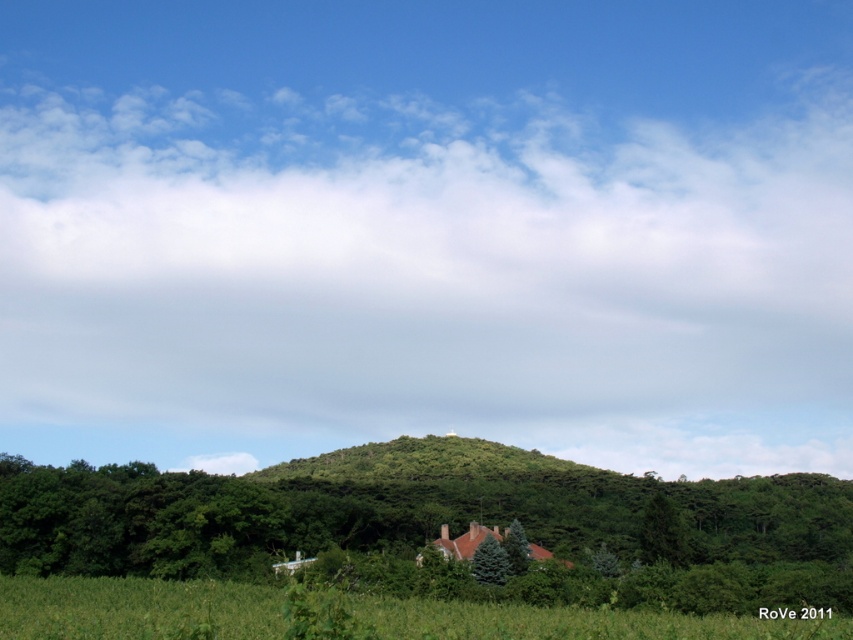
Question: Considering the real-world distances, which object is farthest from the green grassy field at lower center?

Choices:
 (A) green matte tree at lower center
 (B) white fluffy cloud at upper center

Answer: (B)

Question: Which point appears closest to the camera in this image?

Choices:
 (A) (512, 532)
 (B) (492, 556)
 (C) (22, 550)

Answer: (B)

Question: From the image, what is the correct spatial relationship of green leafy tree at center in relation to green matte tree at lower center?

Choices:
 (A) right
 (B) left

Answer: (A)

Question: Among these points, which one is nearest to the camera?

Choices:
 (A) (495, 563)
 (B) (502, 513)
 (C) (521, 572)

Answer: (A)

Question: Is white fluffy cloud at upper center behind green matte tree at lower center?

Choices:
 (A) no
 (B) yes

Answer: (B)

Question: Can you confirm if white fluffy cloud at upper center is positioned below green matte tree at lower center?

Choices:
 (A) no
 (B) yes

Answer: (A)